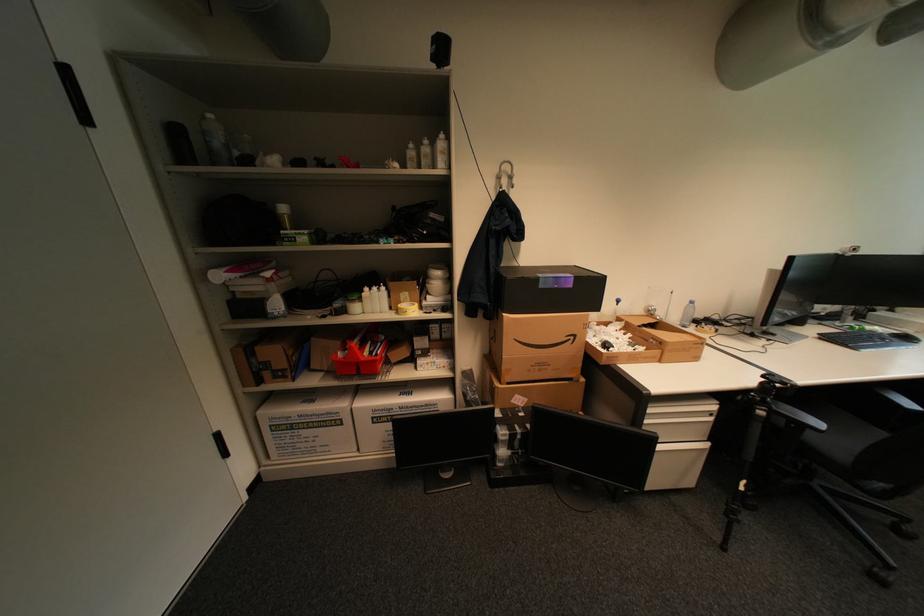
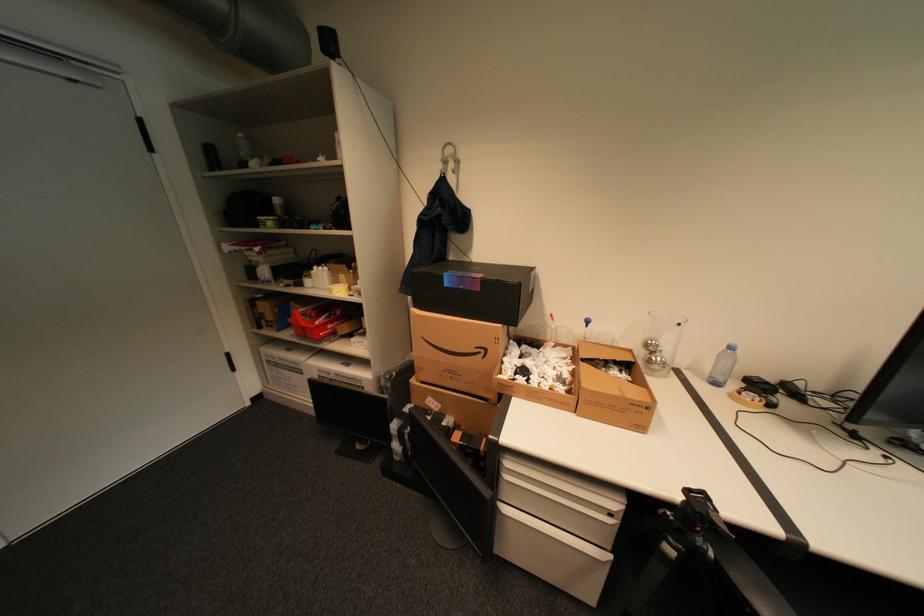
Question: What movement of the cameraman would produce the second image?

Choices:
 (A) Left
 (B) Right
 (C) Forward
 (D) Backward

Answer: (B)